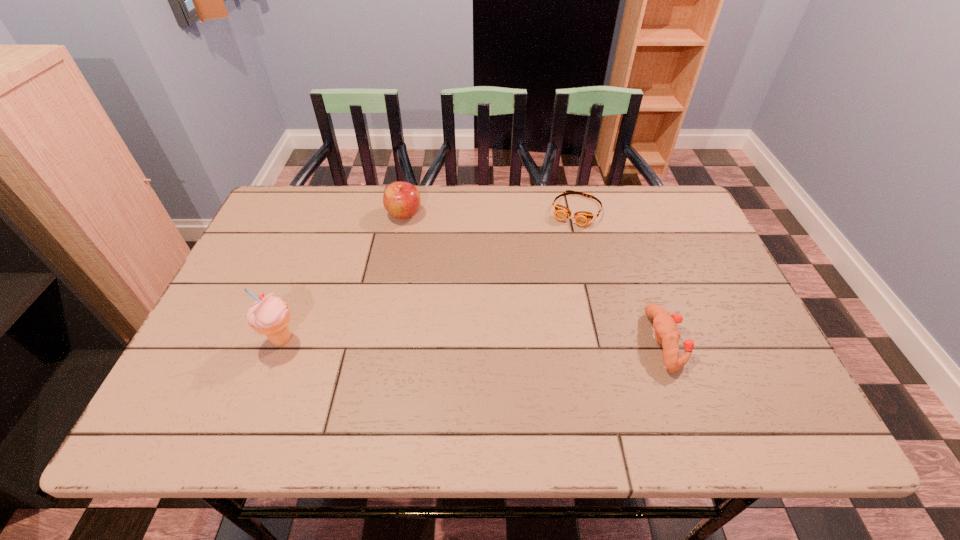
The image size is (960, 540). Identify the location of free space on the desktop that is between the icecream and the third tallest object and is positioned with the lenses facing forward on the second object from right to left. (515, 341).

Find the location of a particular element. Image resolution: width=960 pixels, height=540 pixels. vacant space on the desktop that is between the tallest object and the third tallest object and is positioned on the stem of the second tallest object is located at coordinates (493, 341).